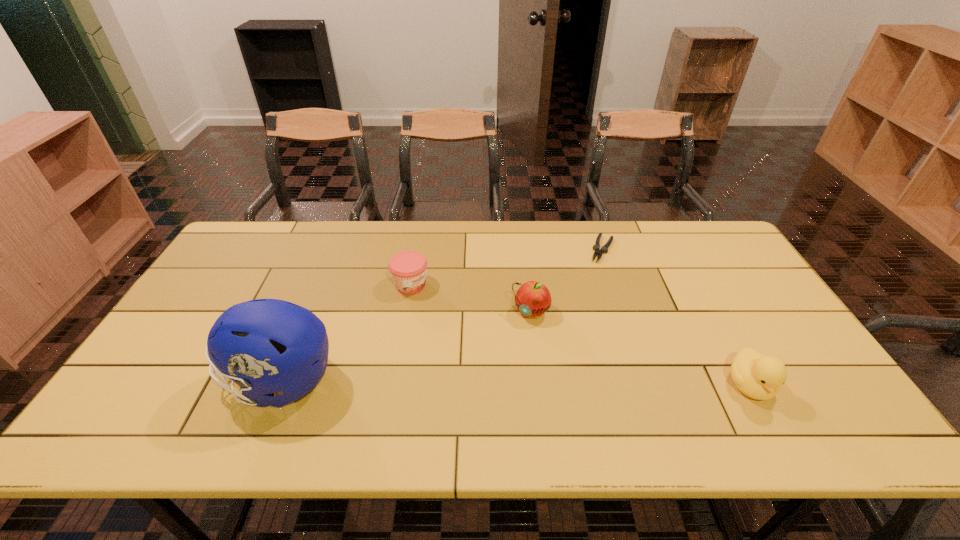
At what (x,y) coordinates should I click in order to perform the action: click on the leftmost object. Please return your answer as a coordinate pair (x, y). Looking at the image, I should click on (265, 346).

I want to click on the tallest object, so click(x=265, y=346).

Identify the location of the rightmost object. The width and height of the screenshot is (960, 540). (760, 377).

Where is `the shortest object`? This screenshot has width=960, height=540. the shortest object is located at coordinates click(604, 249).

Where is `pliers`? This screenshot has height=540, width=960. pliers is located at coordinates (604, 249).

The height and width of the screenshot is (540, 960). Identify the location of apple. (532, 299).

Where is `the third nearest object`? The image size is (960, 540). the third nearest object is located at coordinates (532, 299).

Locate an element on the screen. The width and height of the screenshot is (960, 540). the fourth tallest object is located at coordinates (408, 268).

You are a GUI agent. You are given a task and a screenshot of the screen. Output one action in this format:
    pyautogui.click(x=<x>, y=<y>)
    Task: Click on the jam
    This screenshot has height=540, width=960.
    Given the screenshot: What is the action you would take?
    pyautogui.click(x=408, y=268)

Identify the location of vacant space located 0.170m on the front-facing side of the football helmet. Image resolution: width=960 pixels, height=540 pixels. (153, 381).